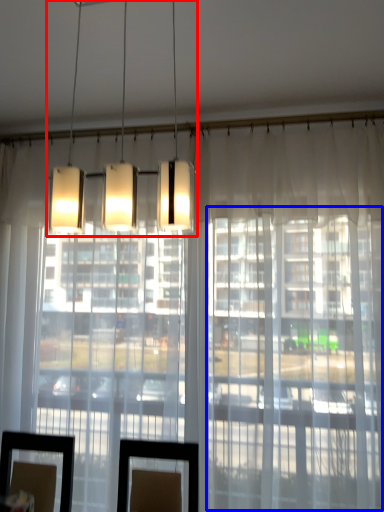
Question: Which object is further to the camera taking this photo, lamp (highlighted by a red box) or glass door (highlighted by a blue box)?

Choices:
 (A) lamp
 (B) glass door

Answer: (B)